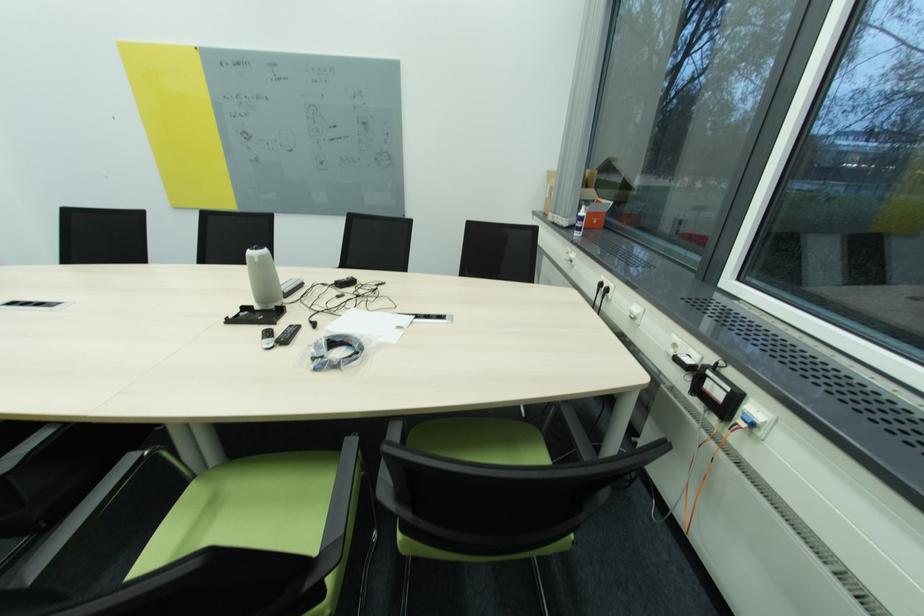
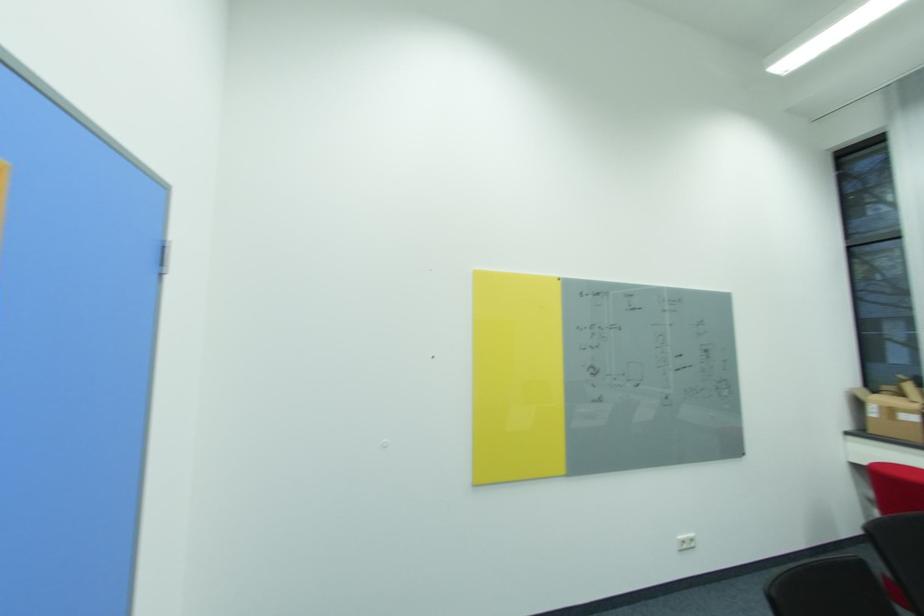
Where in the second image is the point corresponding to point (555, 191) from the first image?

(895, 411)